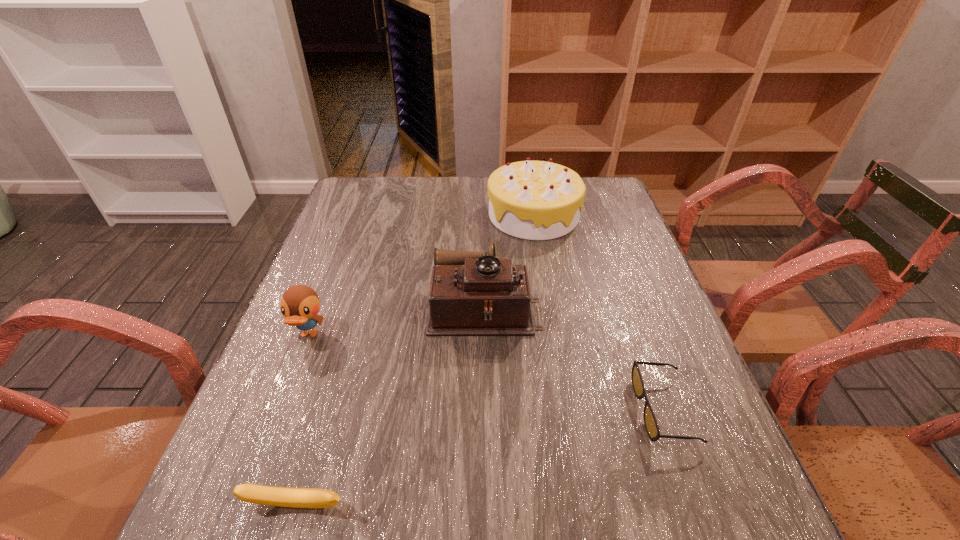
Where is `free space located 0.100m on the front-facing side of the duck`? free space located 0.100m on the front-facing side of the duck is located at coordinates (287, 392).

Locate an element on the screen. The width and height of the screenshot is (960, 540). vacant region located on the front-facing side of the second nearest object is located at coordinates (450, 410).

Find the location of a particular element. This screenshot has height=540, width=960. vacant point located 0.170m on the front-facing side of the second nearest object is located at coordinates (550, 410).

In order to click on free space located on the front-facing side of the second nearest object in this screenshot , I will do `click(450, 410)`.

You are a GUI agent. You are given a task and a screenshot of the screen. Output one action in this format:
    pyautogui.click(x=<x>, y=<y>)
    Task: Click on the object that is at the far edge
    
    Given the screenshot: What is the action you would take?
    (x=535, y=200)

You are a GUI agent. You are given a task and a screenshot of the screen. Output one action in this format:
    pyautogui.click(x=<x>, y=<y>)
    Task: Click on the object that is at the near edge
    
    Given the screenshot: What is the action you would take?
    pyautogui.click(x=252, y=493)

Find the location of a particular element. Image resolution: width=960 pixels, height=540 pixels. duck that is at the left edge is located at coordinates (300, 304).

Find the location of a particular element. banana at the left edge is located at coordinates (252, 493).

Find the location of a particular element. birthday cake that is at the right edge is located at coordinates (535, 200).

Identify the location of sunglasses situated at the right edge. (650, 422).